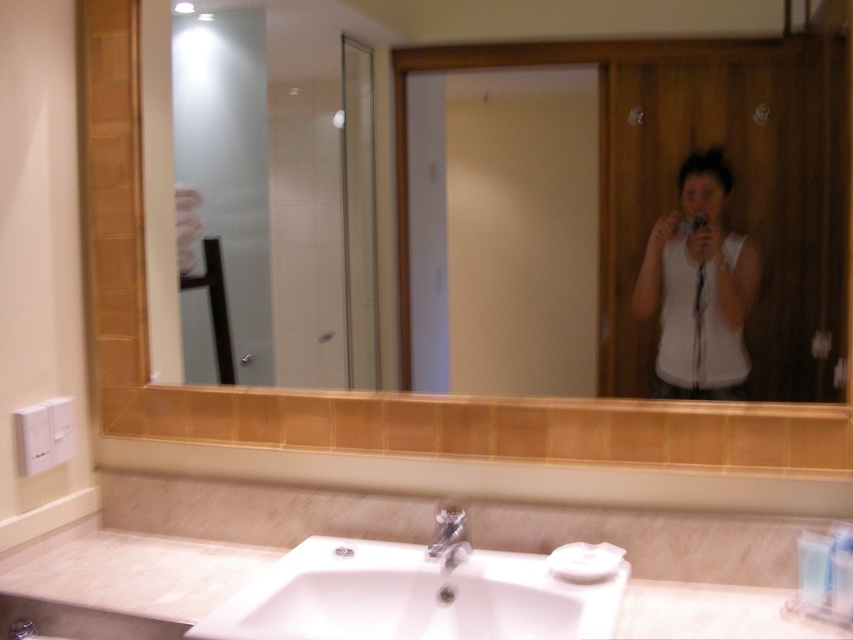
Question: Is wooden frame mirror at upper center smaller than satin nickel faucet at sink center?

Choices:
 (A) no
 (B) yes

Answer: (A)

Question: Which point is closer to the camera?

Choices:
 (A) (141, 48)
 (B) (711, 321)
 (C) (379, 593)

Answer: (C)

Question: Which of the following is the farthest from the observer?

Choices:
 (A) (515, 586)
 (B) (373, 61)
 (C) (434, 554)

Answer: (B)

Question: Is wooden frame mirror at upper center positioned behind white matte tank top at center?

Choices:
 (A) yes
 (B) no

Answer: (B)

Question: Can you confirm if white glossy sink at lower center is positioned to the right of satin nickel faucet at sink center?

Choices:
 (A) no
 (B) yes

Answer: (A)

Question: Among these objects, which one is nearest to the camera?

Choices:
 (A) satin nickel faucet at sink center
 (B) wooden frame mirror at upper center
 (C) white matte tank top at center

Answer: (B)